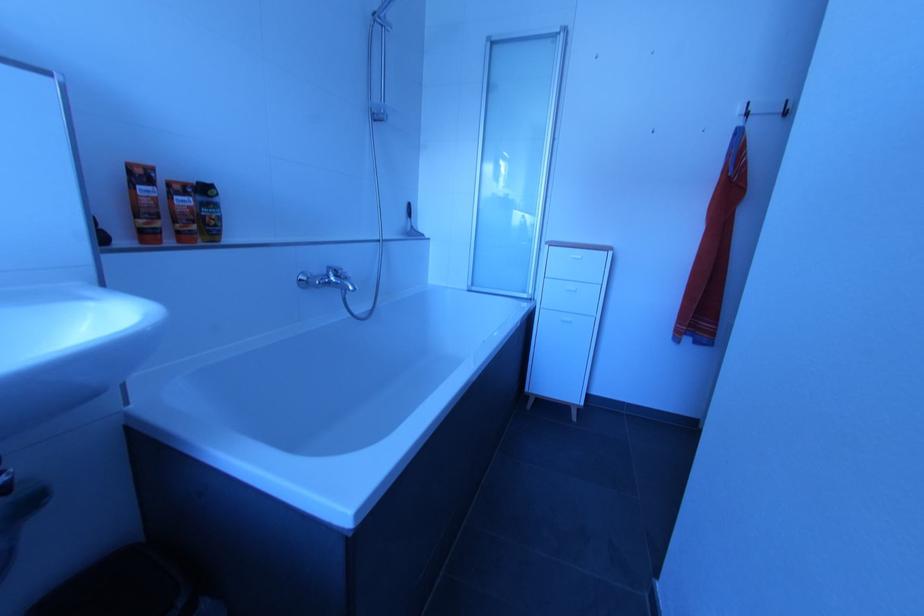
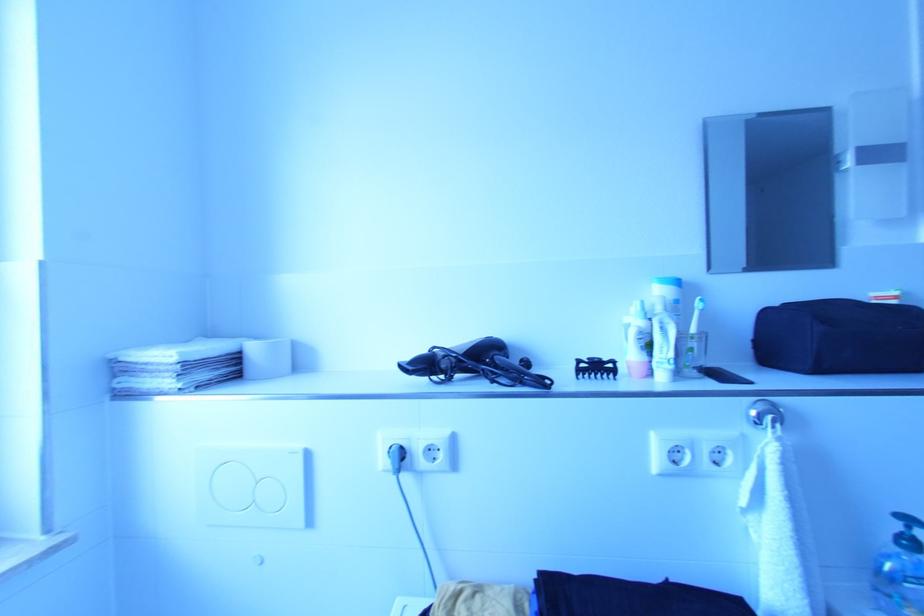
Question: The camera is either moving clockwise (left) or counter-clockwise (right) around the object. The first image is from the beginning of the video and the second image is from the end. Is the camera moving left or right when shooting the video?

Choices:
 (A) Left
 (B) Right

Answer: (B)